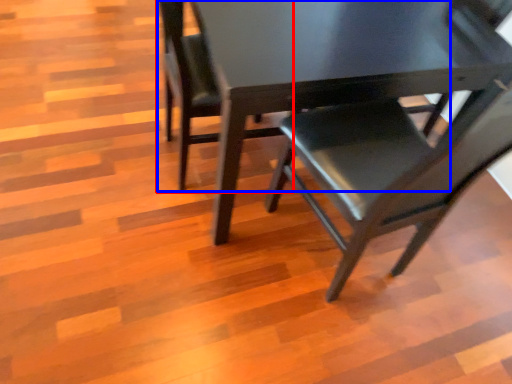
Question: Which of the following is the farthest to the observer, chair (highlighted by a red box) or chair (highlighted by a blue box)?

Choices:
 (A) chair
 (B) chair

Answer: (A)